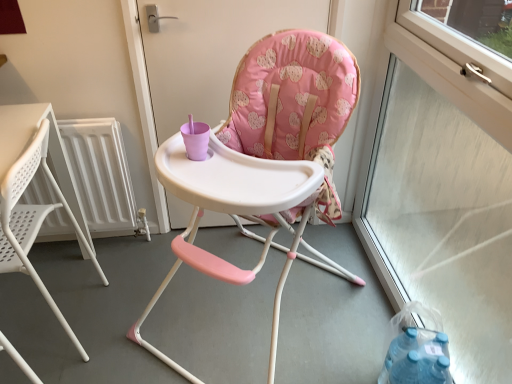
Identify the location of vacant space behind white plastic chair at left, the first chair viewed from the left. (88, 264).